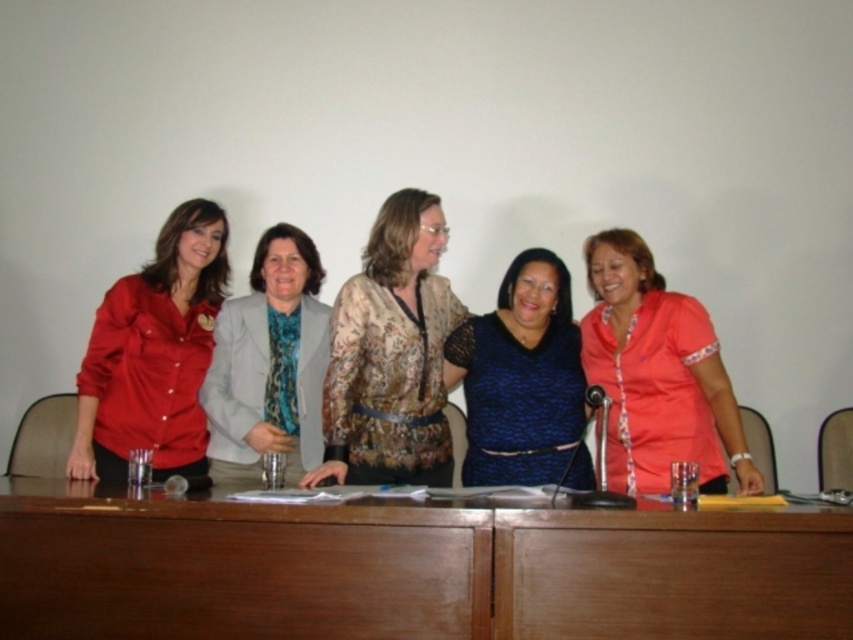
Can you confirm if floral-patterned blouse at center is positioned below blue textured dress at center?

No.

Can you confirm if floral-patterned blouse at center is positioned above blue textured dress at center?

Correct, floral-patterned blouse at center is located above blue textured dress at center.

Who is more distant from viewer, [426,224] or [541,456]?

The point [541,456] is behind.

The width and height of the screenshot is (853, 640). I want to click on floral-patterned blouse at center, so click(392, 355).

Is brown wooden table at center taller than matte red blouse at left?

No, brown wooden table at center is not taller than matte red blouse at left.

From the picture: Who is higher up, brown wooden table at center or matte red blouse at left?

Positioned higher is matte red blouse at left.

Between point (271, 557) and point (170, 307), which one is positioned behind?

The point (170, 307) is more distant.

You are a GUI agent. You are given a task and a screenshot of the screen. Output one action in this format:
    pyautogui.click(x=<x>, y=<y>)
    Task: Click on the brown wooden table at center
    The height and width of the screenshot is (640, 853).
    Given the screenshot: What is the action you would take?
    pyautogui.click(x=413, y=570)

Is brown wooden table at center below matte gray blazer at center?

Yes, brown wooden table at center is below matte gray blazer at center.

Which is in front, point (84, 518) or point (264, 268)?

Point (84, 518) is in front.

You are a GUI agent. You are given a task and a screenshot of the screen. Output one action in this format:
    pyautogui.click(x=<x>, y=<y>)
    Task: Click on the brown wooden table at center
    This screenshot has height=640, width=853.
    Given the screenshot: What is the action you would take?
    pyautogui.click(x=413, y=570)